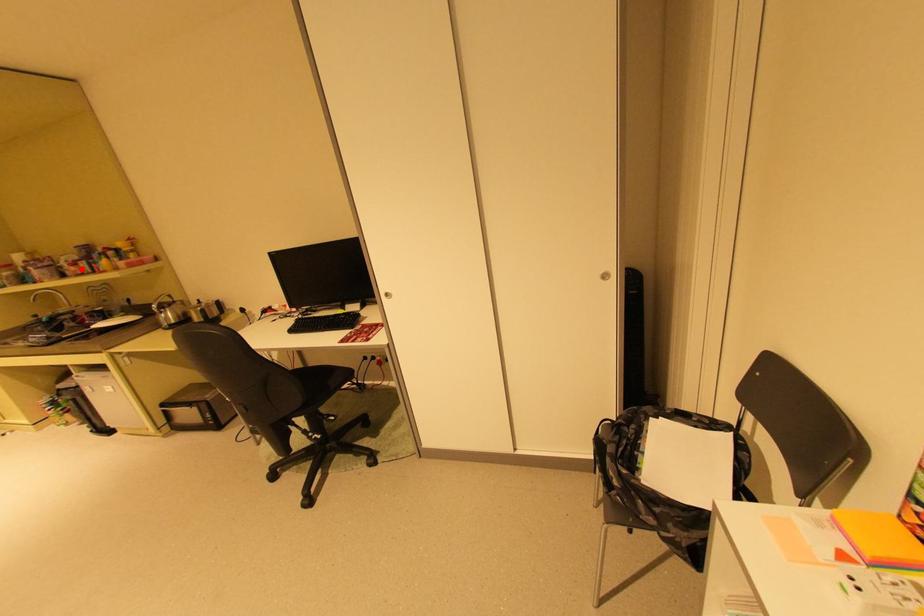
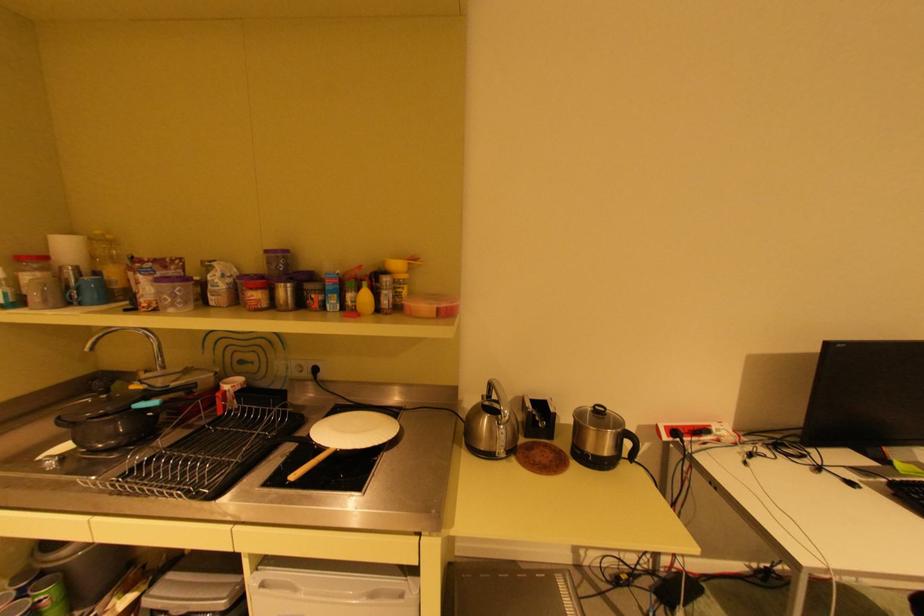
Question: I am providing you with two images of the same scene from different viewpoints. A red point is shown in image1. For the corresponding object point in image2, is it positioned nearer or farther from the camera?

Choices:
 (A) Nearer
 (B) Farther

Answer: (A)